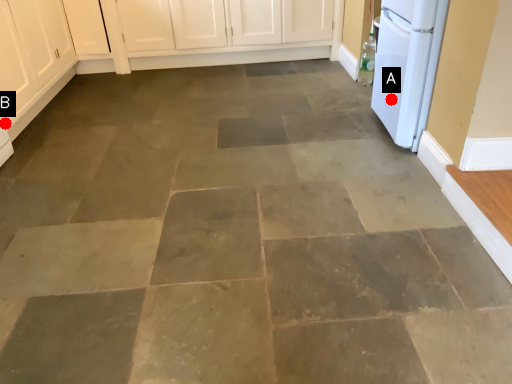
Question: Two points are circled on the image, labeled by A and B beside each circle. Which of the following is the closest to the observer?

Choices:
 (A) A is closer
 (B) B is closer

Answer: (B)